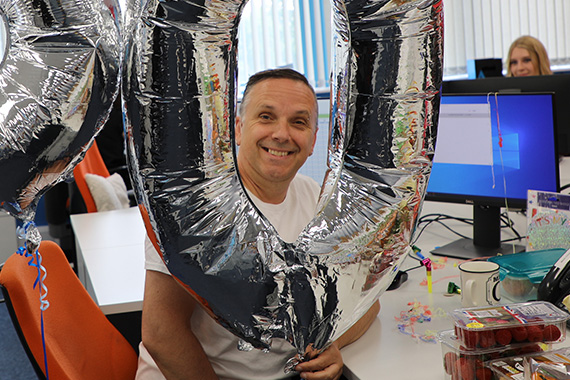
What are the coordinates of `orange chairs` in the screenshot? It's located at (81, 165), (71, 298).